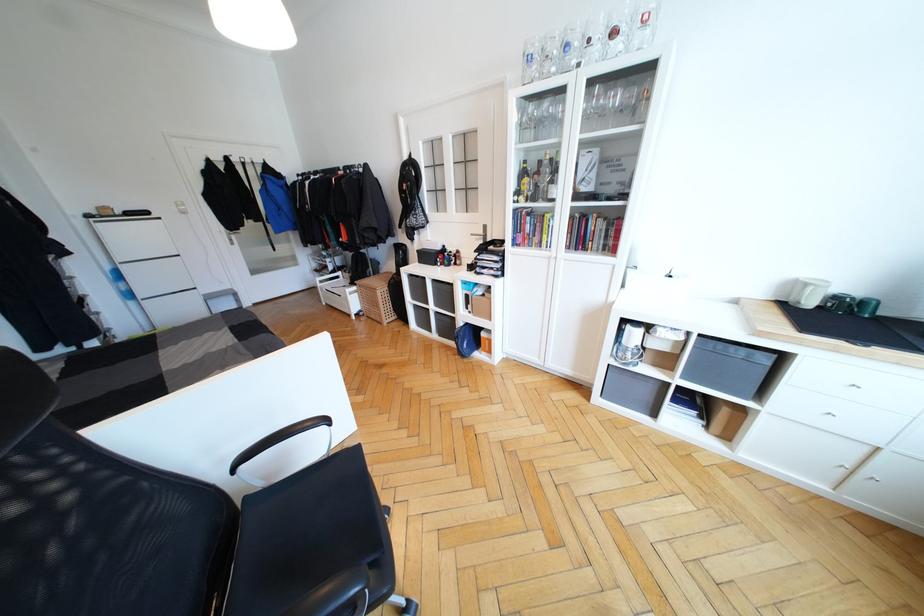
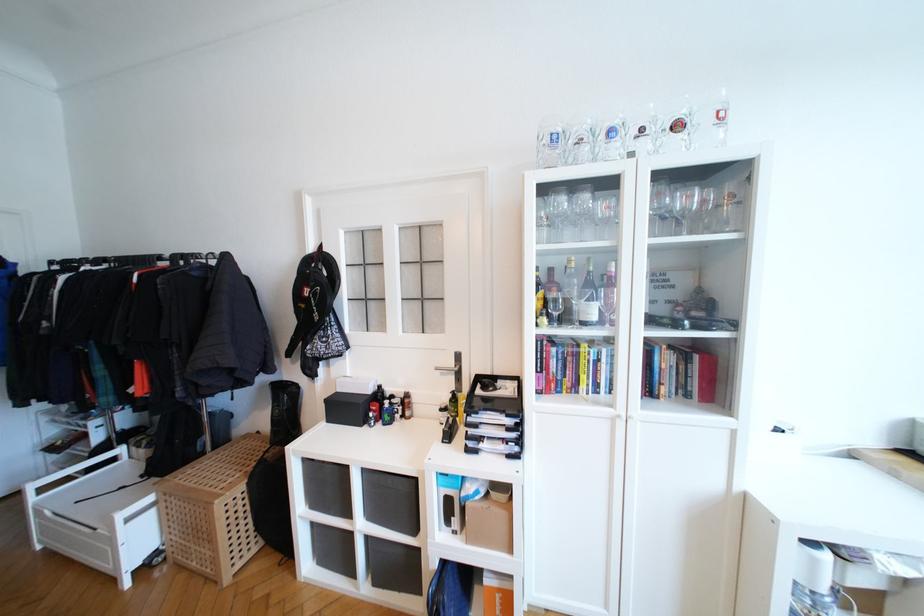
In the second image, find the point that corresponds to (x=621, y=99) in the first image.

(691, 200)